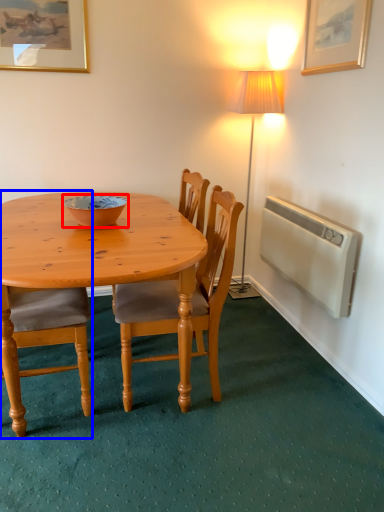
Question: Among these objects, which one is nearest to the camera, bowl (highlighted by a red box) or chair (highlighted by a blue box)?

Choices:
 (A) bowl
 (B) chair

Answer: (B)